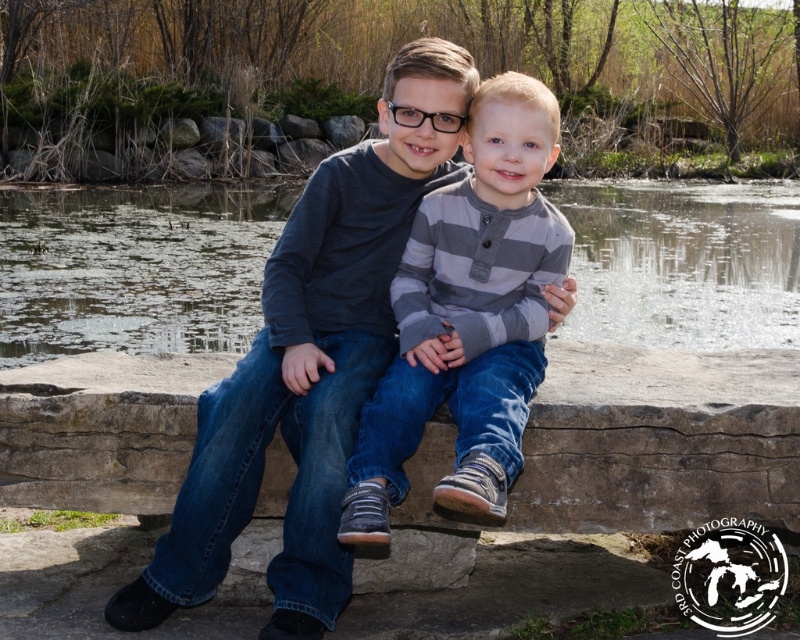
Question: Can you confirm if clear water at center is bigger than matte blue jeans at center?

Choices:
 (A) no
 (B) yes

Answer: (B)

Question: Is clear water at center behind matte blue jeans at center?

Choices:
 (A) no
 (B) yes

Answer: (B)

Question: Which point is farther from the camera taking this photo?

Choices:
 (A) (354, 168)
 (B) (494, 374)
 (C) (682, 340)

Answer: (C)

Question: Which of these objects is positioned closest to the matte blue jeans at center?

Choices:
 (A) gray striped shirt at center
 (B) clear water at center

Answer: (A)

Question: Can you confirm if clear water at center is positioned below matte blue jeans at center?

Choices:
 (A) yes
 (B) no

Answer: (B)

Question: Which point is closer to the camera taking this photo?

Choices:
 (A) (293, 369)
 (B) (166, 218)
 (C) (482, 138)

Answer: (A)